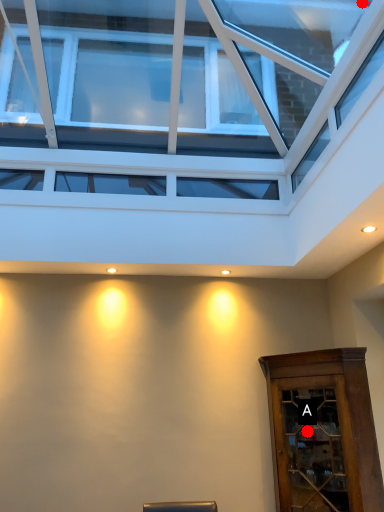
Question: Two points are circled on the image, labeled by A and B beside each circle. Which point is closer to the camera?

Choices:
 (A) A is closer
 (B) B is closer

Answer: (A)